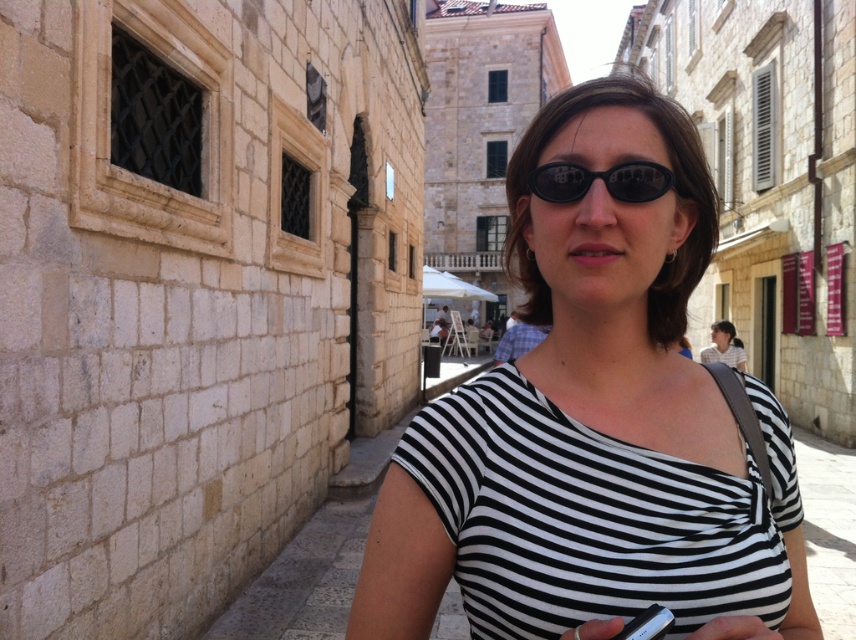
Question: Can you confirm if black and white striped shirt at center is smaller than black matte sunglasses at center?

Choices:
 (A) no
 (B) yes

Answer: (A)

Question: Is black and white striped shirt at center to the right of black matte sunglasses at center from the viewer's perspective?

Choices:
 (A) no
 (B) yes

Answer: (B)

Question: Is black and white striped shirt at center positioned at the back of black matte sunglasses at center?

Choices:
 (A) no
 (B) yes

Answer: (A)

Question: Which object is closer to the camera taking this photo?

Choices:
 (A) black and white striped shirt at center
 (B) black matte sunglasses at center

Answer: (A)

Question: Which point is closer to the camera?

Choices:
 (A) click(620, 332)
 (B) click(575, 166)

Answer: (B)

Question: Which point is farther to the camera?

Choices:
 (A) (590, 420)
 (B) (562, 180)

Answer: (A)